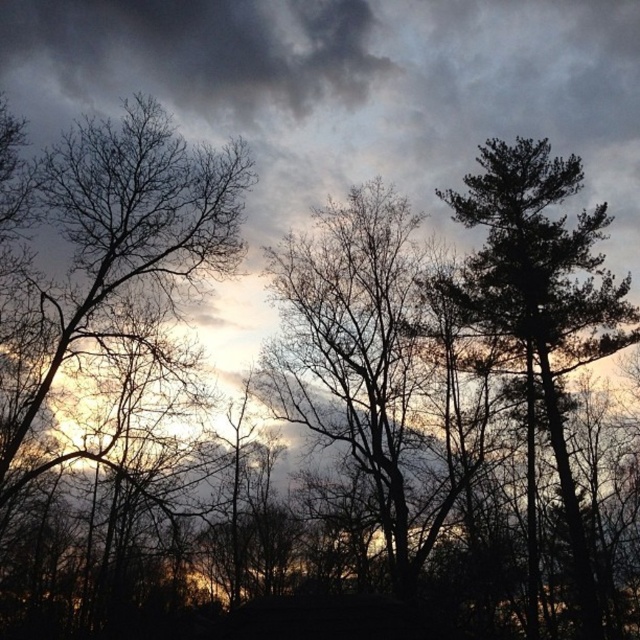
You are an artist trying to sketch this forest scene. You want to ensure the silhouette bark tree at center and the dark green textured tree at right are proportionally accurate. Which of these two trees should you draw as taller?

The dark green textured tree at right should be drawn as taller because the silhouette bark tree at center has a lesser height compared to dark green textured tree at right.